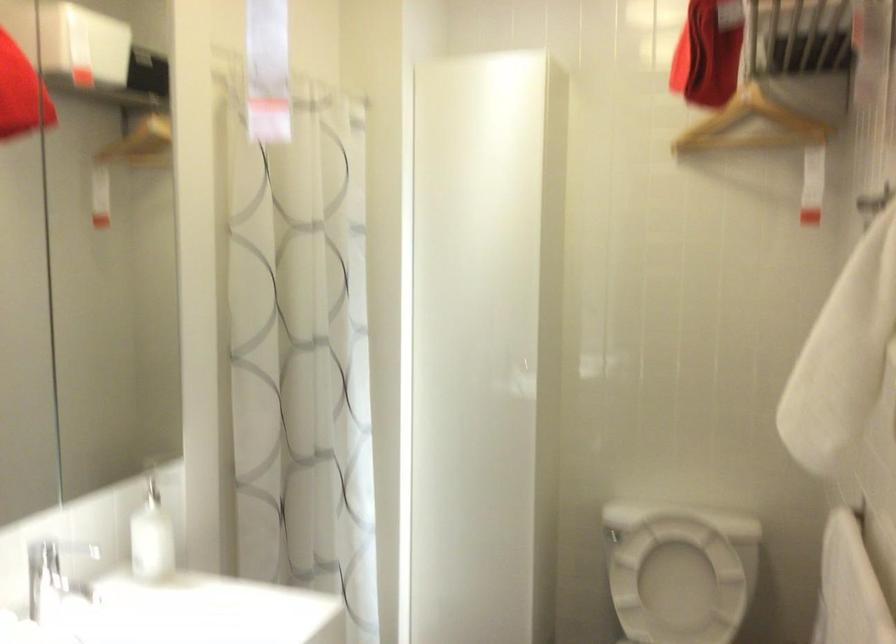
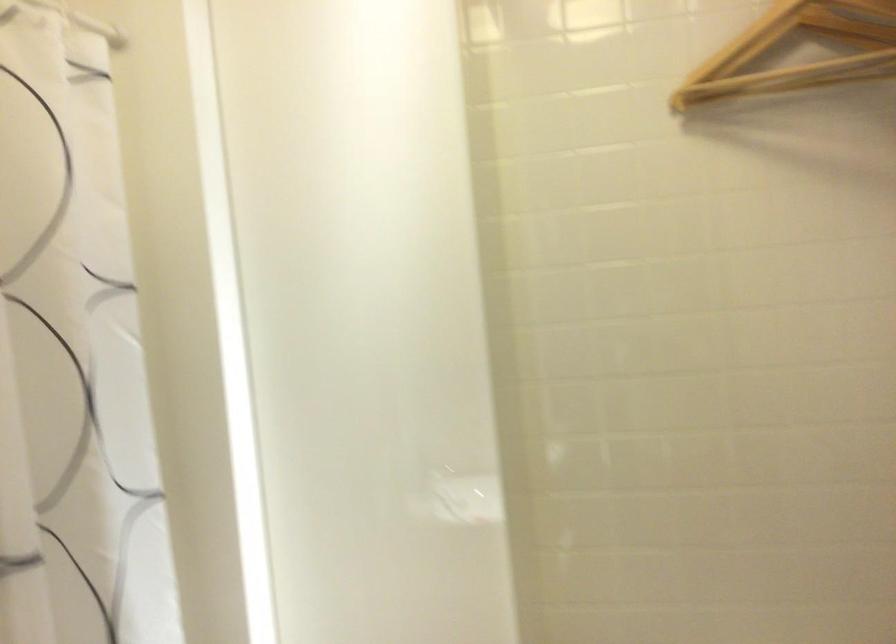
Locate, in the second image, the point that corresponds to (761,118) in the first image.

(797, 51)